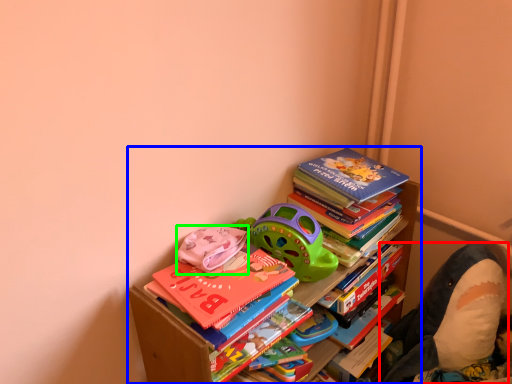
Question: Which is nearer to the toy (highlighted by a red box)? bookcase (highlighted by a blue box) or toy (highlighted by a green box).

Choices:
 (A) bookcase
 (B) toy

Answer: (B)